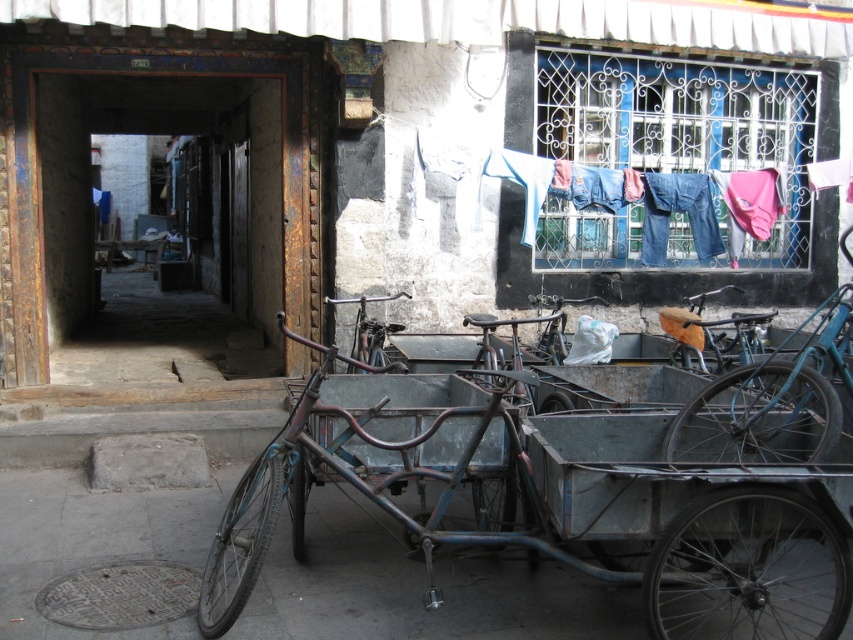
Is smooth concrete pavement at lower center thinner than denim jeans at upper right?

In fact, smooth concrete pavement at lower center might be wider than denim jeans at upper right.

Where is `smooth concrete pavement at lower center`? This screenshot has height=640, width=853. smooth concrete pavement at lower center is located at coordinates (419, 589).

Is point (466, 225) farther from viewer compared to point (544, 358)?

Yes, it is behind point (544, 358).

The width and height of the screenshot is (853, 640). I want to click on denim jeans at upper right, so click(521, 195).

Can you confirm if rusty metal tricycle at center is positioned to the right of metallic silver bicycle at center?

In fact, rusty metal tricycle at center is to the left of metallic silver bicycle at center.

Is rusty metal tricycle at center to the left of metallic silver bicycle at center from the viewer's perspective?

Yes, rusty metal tricycle at center is to the left of metallic silver bicycle at center.

Is point (459, 456) farther from camera compared to point (549, 336)?

No, (459, 456) is closer to viewer.

At what (x,y) coordinates should I click in order to perform the action: click on rusty metal tricycle at center. Please return your answer as a coordinate pair (x, y). Image resolution: width=853 pixels, height=640 pixels. Looking at the image, I should click on (556, 499).